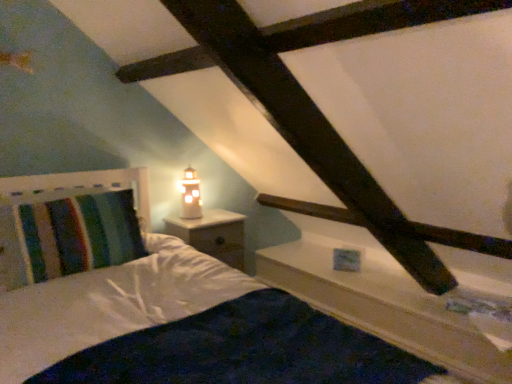
Question: Is white wood nightstand at center touching striped fabric pillow at left?

Choices:
 (A) no
 (B) yes

Answer: (A)

Question: Considering the relative sizes of white wood nightstand at center and striped fabric pillow at left in the image provided, is white wood nightstand at center wider than striped fabric pillow at left?

Choices:
 (A) no
 (B) yes

Answer: (A)

Question: Is striped fabric pillow at left inside white wood nightstand at center?

Choices:
 (A) no
 (B) yes

Answer: (A)

Question: Is white wood nightstand at center outside striped fabric pillow at left?

Choices:
 (A) yes
 (B) no

Answer: (A)

Question: From a real-world perspective, does white wood nightstand at center stand above striped fabric pillow at left?

Choices:
 (A) yes
 (B) no

Answer: (B)

Question: Is white wood nightstand at center bigger or smaller than white wood ledge at upper right?

Choices:
 (A) big
 (B) small

Answer: (B)

Question: In terms of width, does white wood nightstand at center look wider or thinner when compared to white wood ledge at upper right?

Choices:
 (A) thin
 (B) wide

Answer: (A)

Question: From the image's perspective, is white wood nightstand at center above or below white wood ledge at upper right?

Choices:
 (A) below
 (B) above

Answer: (B)

Question: From a real-world perspective, is white wood nightstand at center physically located above or below white wood ledge at upper right?

Choices:
 (A) below
 (B) above

Answer: (B)

Question: Does point (193, 195) appear closer or farther from the camera than point (108, 225)?

Choices:
 (A) farther
 (B) closer

Answer: (A)

Question: Looking at their shapes, would you say matte glass table lamp at upper center is wider or thinner than striped fabric pillow at left?

Choices:
 (A) wide
 (B) thin

Answer: (B)

Question: Is matte glass table lamp at upper center in front of or behind striped fabric pillow at left in the image?

Choices:
 (A) behind
 (B) front

Answer: (A)

Question: Looking at the image, does matte glass table lamp at upper center seem bigger or smaller compared to striped fabric pillow at left?

Choices:
 (A) big
 (B) small

Answer: (B)

Question: Considering the positions of white wood ledge at upper right and striped fabric pillow at left in the image, is white wood ledge at upper right taller or shorter than striped fabric pillow at left?

Choices:
 (A) short
 (B) tall

Answer: (B)

Question: In the image, is white wood ledge at upper right on the left side or the right side of striped fabric pillow at left?

Choices:
 (A) right
 (B) left

Answer: (A)